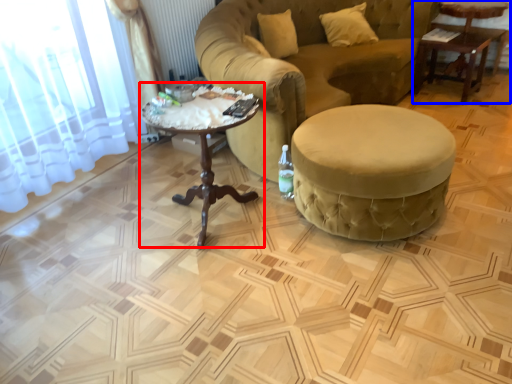
Question: Which object appears farthest to the camera in this image, coffee table (highlighted by a red box) or table (highlighted by a blue box)?

Choices:
 (A) coffee table
 (B) table

Answer: (B)